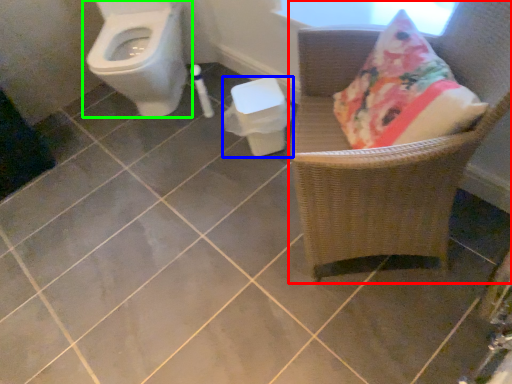
Question: Which object is positioned closest to chair (highlighted by a red box)? Select from potty (highlighted by a blue box) and toilet (highlighted by a green box).

Choices:
 (A) potty
 (B) toilet

Answer: (A)